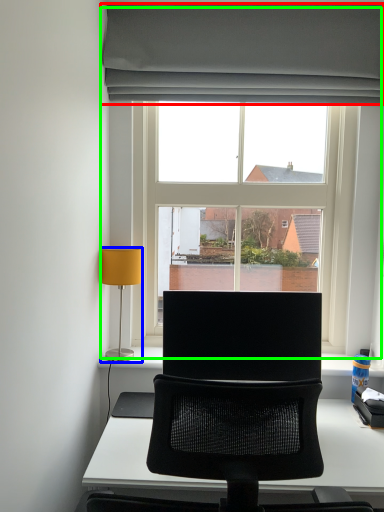
Question: Which is farther away from curtain (highlighted by a red box)? lamp (highlighted by a blue box) or window (highlighted by a green box)?

Choices:
 (A) lamp
 (B) window

Answer: (A)